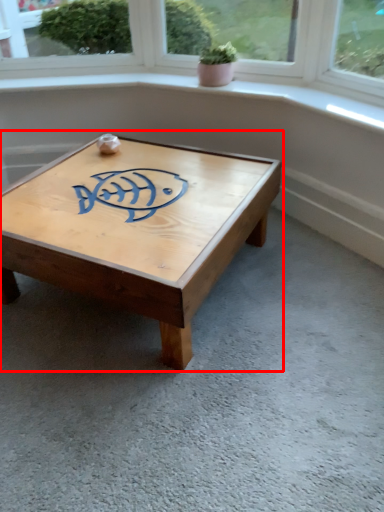
Question: From the image's perspective, what is the correct spatial positioning of coffee table (annotated by the red box) in reference to houseplant?

Choices:
 (A) below
 (B) above

Answer: (A)